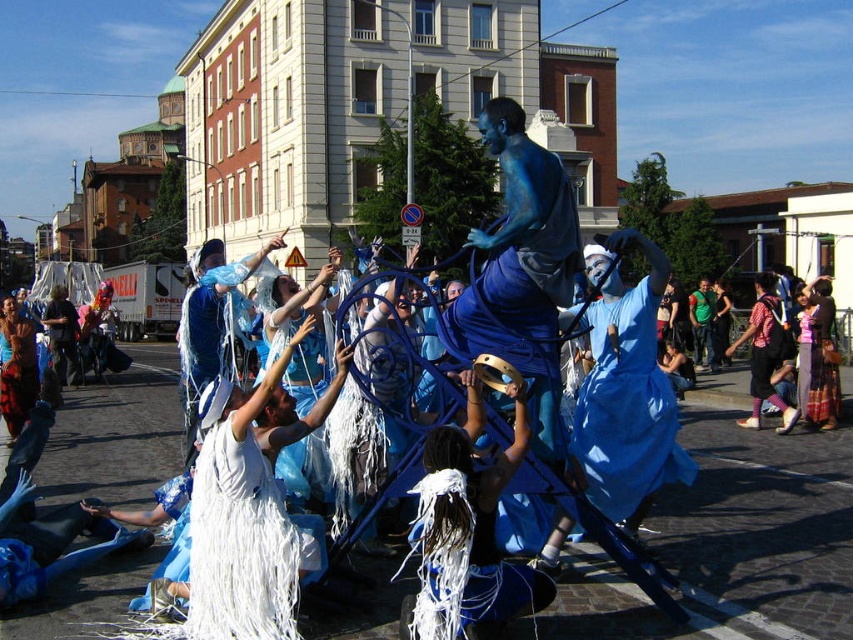
Question: Which is farther from the white fringed fabric at lower center?

Choices:
 (A) plaid fabric shirt at lower right
 (B) blue fabric dress at center
 (C) white feathered dress at center

Answer: (C)

Question: Does blue fabric dress at center appear on the left side of white fringed fabric at lower center?

Choices:
 (A) no
 (B) yes

Answer: (A)

Question: Which point appears farthest from the camera in this image?

Choices:
 (A) (201, 529)
 (B) (831, 406)
 (C) (27, 352)
 (D) (468, 609)

Answer: (C)

Question: Is white fringed fabric at lower center positioned before white feathered dress at center?

Choices:
 (A) yes
 (B) no

Answer: (A)

Question: Can you confirm if blue fabric dress at center is positioned below plaid fabric shirt at lower right?

Choices:
 (A) yes
 (B) no

Answer: (A)

Question: Which point is closer to the camera?

Choices:
 (A) plaid fabric shirt at lower right
 (B) white fringed dress at center
 (C) white fringed fabric at lower center

Answer: (C)